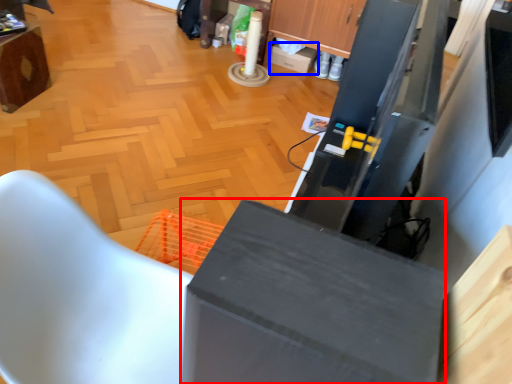
Question: Which object is further to the camera taking this photo, cabinetry (highlighted by a red box) or box (highlighted by a blue box)?

Choices:
 (A) cabinetry
 (B) box

Answer: (B)